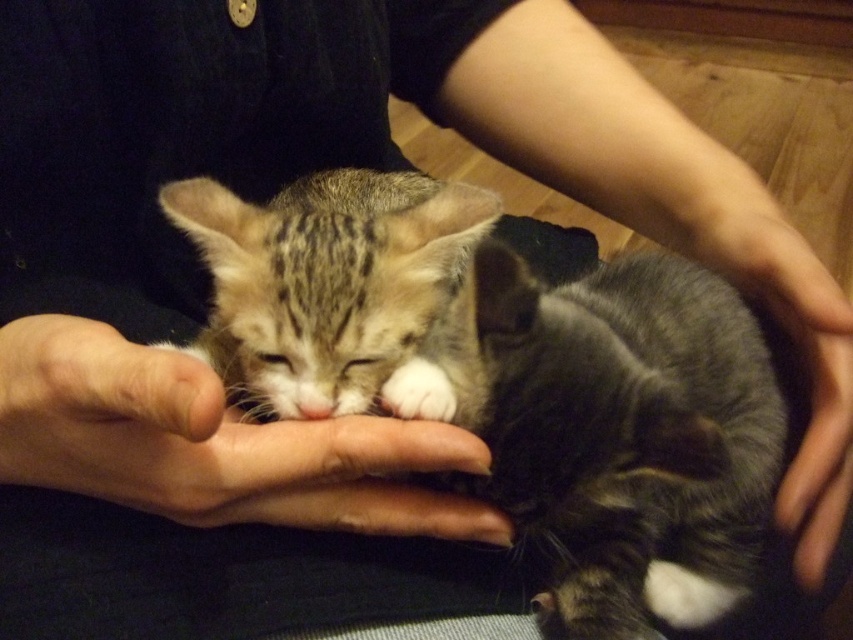
Question: Which point appears farthest from the camera in this image?

Choices:
 (A) (3, 362)
 (B) (293, 316)

Answer: (B)

Question: Is tabby fur kitten at center closer to the viewer compared to gray soft hand at lower right?

Choices:
 (A) no
 (B) yes

Answer: (B)

Question: Which object is farther from the camera taking this photo?

Choices:
 (A) tabby fur kitten at center
 (B) smooth skin hand at center
 (C) gray soft hand at lower right

Answer: (C)

Question: Does smooth skin hand at center have a smaller size compared to tabby fur kitten at center?

Choices:
 (A) no
 (B) yes

Answer: (B)

Question: Which point is farther to the camera?

Choices:
 (A) (740, 248)
 (B) (73, 451)

Answer: (A)

Question: Is smooth skin hand at center bigger than gray soft hand at lower right?

Choices:
 (A) yes
 (B) no

Answer: (B)